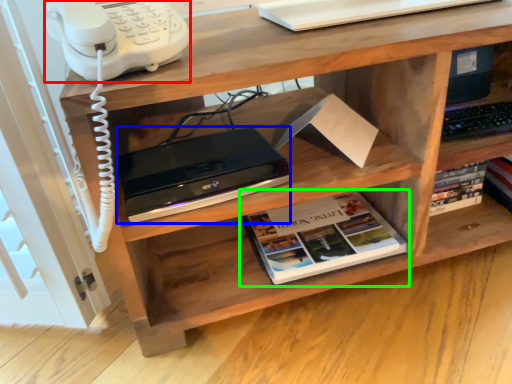
Question: Based on their relative distances, which object is farther from corded phone (highlighted by a red box)? Choose from computer (highlighted by a blue box) and book (highlighted by a green box).

Choices:
 (A) computer
 (B) book

Answer: (B)